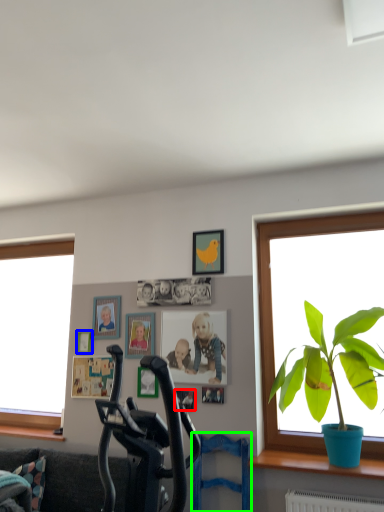
Question: Considering the real-world distances, which object is farthest from picture frame (highlighted by a red box)? picture frame (highlighted by a blue box) or swivel chair (highlighted by a green box)?

Choices:
 (A) picture frame
 (B) swivel chair

Answer: (A)